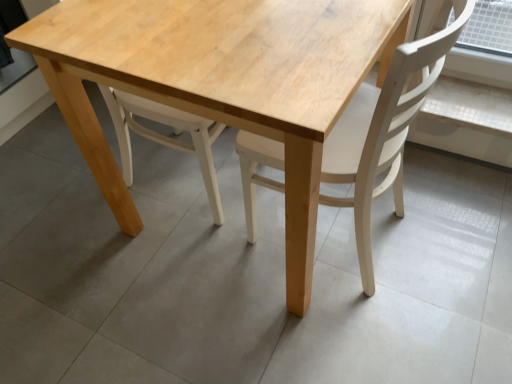
Identify the location of light wood chair at center. (383, 132).

What do you see at coordinates (383, 132) in the screenshot?
I see `light wood chair at center` at bounding box center [383, 132].

What do you see at coordinates (221, 82) in the screenshot? The image size is (512, 384). I see `natural wood table at center` at bounding box center [221, 82].

The width and height of the screenshot is (512, 384). In order to click on natural wood table at center in this screenshot , I will do `click(221, 82)`.

What is the approximate height of natural wood table at center?

It is 29.34 inches.

Locate an element on the screen. Image resolution: width=512 pixels, height=384 pixels. light wood chair at center is located at coordinates (383, 132).

Is light wood chair at center at the right side of natural wood table at center?

Yes.

Is the position of light wood chair at center more distant than that of natural wood table at center?

No, it is not.

Is point (283, 150) farther from camera compared to point (16, 45)?

Yes, point (283, 150) is behind point (16, 45).

From the image's perspective, is light wood chair at center above or below natural wood table at center?

Clearly, from the image's perspective, light wood chair at center is below natural wood table at center.

In the scene shown: From a real-world perspective, is light wood chair at center located beneath natural wood table at center?

Actually, light wood chair at center is physically above natural wood table at center in the real world.

Considering the relative sizes of light wood chair at center and natural wood table at center in the image provided, is light wood chair at center wider than natural wood table at center?

No, light wood chair at center is not wider than natural wood table at center.

Which of these two, light wood chair at center or natural wood table at center, stands shorter?

With less height is natural wood table at center.

Who is bigger, light wood chair at center or natural wood table at center?

natural wood table at center.

Is light wood chair at center inside or outside of natural wood table at center?

light wood chair at center is enclosed within natural wood table at center.

Would you consider light wood chair at center to be distant from natural wood table at center?

That's not correct — light wood chair at center is a little close to natural wood table at center.

Is natural wood table at center at the back of light wood chair at center?

Yes.

Based on the photo, how different are the orientations of light wood chair at center and natural wood table at center in degrees?

87.3 degrees.

I want to click on round table on the left of light wood chair at center, so coord(221,82).

Which object is positioned more to the left, natural wood table at center or light wood chair at center?

natural wood table at center.

Is natural wood table at center behind light wood chair at center?

Yes, natural wood table at center is further from the viewer.

Which is further, (x=284, y=83) or (x=372, y=142)?

The point (x=372, y=142) is farther from the camera.

From the image's perspective, is natural wood table at center located above light wood chair at center?

Correct, natural wood table at center appears higher than light wood chair at center in the image.

From a real-world perspective, does natural wood table at center sit lower than light wood chair at center?

Yes, from a real-world perspective, natural wood table at center is beneath light wood chair at center.

Considering the relative sizes of natural wood table at center and light wood chair at center in the image provided, is natural wood table at center wider than light wood chair at center?

Yes.

From their relative heights in the image, would you say natural wood table at center is taller or shorter than light wood chair at center?

Clearly, natural wood table at center is shorter compared to light wood chair at center.

Is natural wood table at center bigger or smaller than light wood chair at center?

Considering their sizes, natural wood table at center takes up more space than light wood chair at center.

Is natural wood table at center positioned beyond the bounds of light wood chair at center?

Absolutely, natural wood table at center is external to light wood chair at center.

Is natural wood table at center beside light wood chair at center?

natural wood table at center is not next to light wood chair at center, and they're not touching.

Is natural wood table at center looking in the opposite direction of light wood chair at center?

natural wood table at center is not turned away from light wood chair at center.

Where is `round table behind the light wood chair at center`? This screenshot has height=384, width=512. round table behind the light wood chair at center is located at coordinates (221, 82).

Where is `round table behind the light wood chair at center`? The height and width of the screenshot is (384, 512). round table behind the light wood chair at center is located at coordinates (221, 82).

Find the location of `round table above the light wood chair at center (from the image's perspective)`. round table above the light wood chair at center (from the image's perspective) is located at coordinates (221, 82).